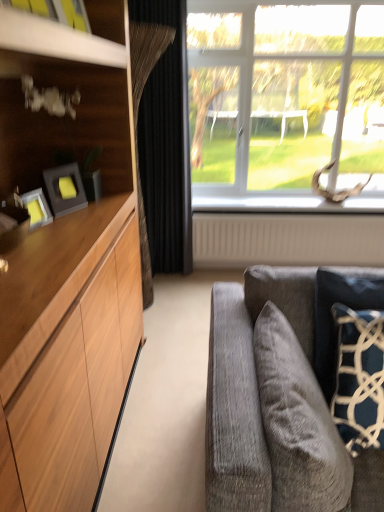
Question: Is point (271, 506) closer or farther from the camera than point (173, 209)?

Choices:
 (A) farther
 (B) closer

Answer: (B)

Question: From a real-world perspective, is velvet gray pillow at lower right, the second pillow from the right, physically located above or below black velvet curtain at center?

Choices:
 (A) below
 (B) above

Answer: (A)

Question: Which of these objects is positioned farthest from the dark blue textured pillow at right, which is counted as the first pillow, starting from the right?

Choices:
 (A) velvet gray pillow at lower right, the second pillow from the right
 (B) matte black picture frame at left
 (C) black velvet curtain at center
 (D) clear glass window at upper right
 (E) beige textured radiator at lower center

Answer: (D)

Question: Considering the real-world distances, which object is farthest from the velvet gray pillow at lower right, the second pillow from the right?

Choices:
 (A) dark blue textured pillow at right, which is counted as the first pillow, starting from the right
 (B) matte black picture frame at left
 (C) clear glass window at upper right
 (D) beige textured radiator at lower center
 (E) black velvet curtain at center

Answer: (C)